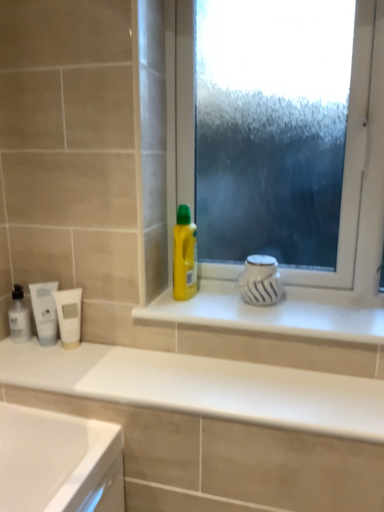
At what (x,y) coordinates should I click in order to perform the action: click on vacant region to the left of white glossy jar at center. Please return your answer as a coordinate pair (x, y). The width and height of the screenshot is (384, 512). Looking at the image, I should click on (207, 306).